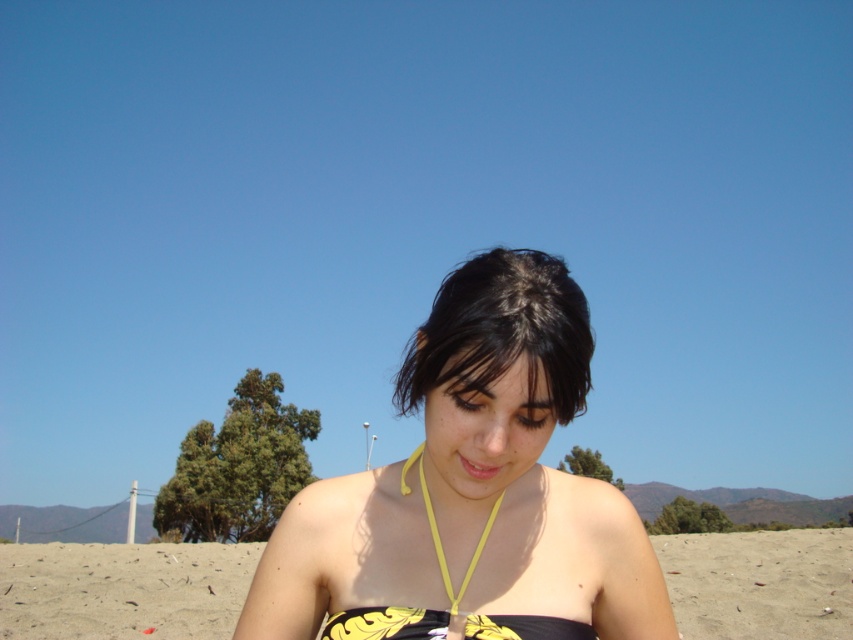
Is black/yellow fabric bikini top at center taller than dark brown hair at center?

Yes.

Does black/yellow fabric bikini top at center have a larger size compared to dark brown hair at center?

Yes.

Where is `black/yellow fabric bikini top at center`? The height and width of the screenshot is (640, 853). black/yellow fabric bikini top at center is located at coordinates (123, 589).

Does black matte swimsuit at center appear over black/yellow fabric bikini top at center?

Yes, black matte swimsuit at center is above black/yellow fabric bikini top at center.

What do you see at coordinates (473, 481) in the screenshot?
I see `black matte swimsuit at center` at bounding box center [473, 481].

Which is in front, point (521, 616) or point (83, 573)?

Point (521, 616)

Where is `black matte swimsuit at center`? black matte swimsuit at center is located at coordinates (473, 481).

Can you confirm if black matte swimsuit at center is taller than dark brown hair at center?

Correct, black matte swimsuit at center is much taller as dark brown hair at center.

In order to click on black matte swimsuit at center in this screenshot , I will do `click(473, 481)`.